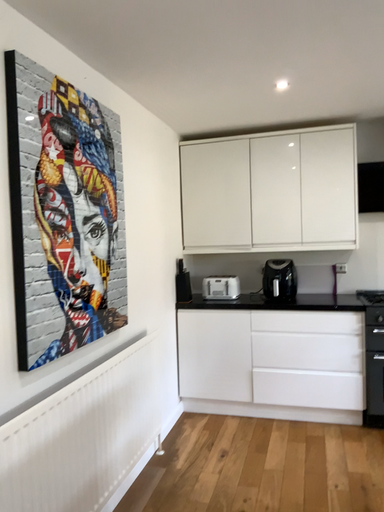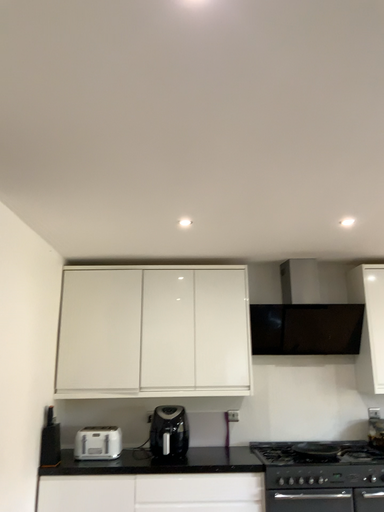
Question: How did the camera likely rotate when shooting the video?

Choices:
 (A) rotated upward
 (B) rotated downward

Answer: (A)